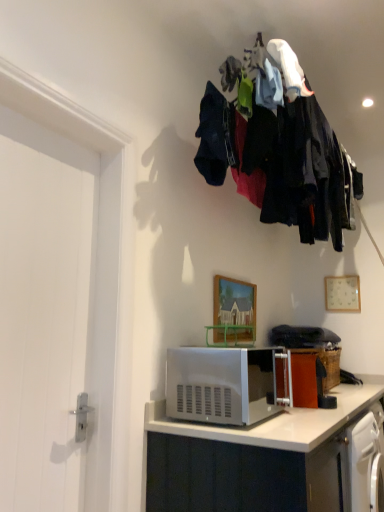
Describe the element at coordinates (342, 293) in the screenshot. This screenshot has width=384, height=512. I see `wooden picture frame at upper right, which appears as the 1th picture frame when viewed from the right` at that location.

What is the approximate width of wooden picture frame at upper right, the second picture frame positioned from the front?

wooden picture frame at upper right, the second picture frame positioned from the front, is 1.20 inches in width.

What do you see at coordinates (220, 385) in the screenshot? The height and width of the screenshot is (512, 384). I see `satin silver microwave at lower center` at bounding box center [220, 385].

What do you see at coordinates (44, 311) in the screenshot? Image resolution: width=384 pixels, height=512 pixels. I see `white smooth door at left` at bounding box center [44, 311].

Locate an element on the screen. Image resolution: width=384 pixels, height=512 pixels. wooden picture frame at upper right, which is counted as the 2th picture frame, starting from the left is located at coordinates (342, 293).

From the image's perspective, which one is positioned lower, silver metallic microwave at lower center or wooden painted picture frame at center, the second picture frame positioned from the back?

silver metallic microwave at lower center.

Is point (344, 395) more distant than point (253, 298)?

No, (344, 395) is closer to viewer.

From a real-world perspective, which picture frame is the 1st one above the silver metallic microwave at lower center? Please provide its 2D coordinates.

[(234, 310)]

Do you think silver metallic microwave at lower center is within wooden painted picture frame at center, placed as the first picture frame when sorted from front to back, or outside of it?

silver metallic microwave at lower center is outside wooden painted picture frame at center, placed as the first picture frame when sorted from front to back.

Considering the positions of points (303, 414) and (257, 374), is point (303, 414) farther from camera compared to point (257, 374)?

No, (303, 414) is in front of (257, 374).

Is silver metallic microwave at lower center far away from satin silver microwave at lower center?

No.

From the image's perspective, which is below, silver metallic microwave at lower center or satin silver microwave at lower center?

From the image's view, silver metallic microwave at lower center is below.

Would you say silver metallic microwave at lower center is to the left or to the right of satin silver microwave at lower center in the picture?

silver metallic microwave at lower center is positioned on satin silver microwave at lower center's right side.

From a real-world perspective, is satin silver microwave at lower center above or below dark fabric clothes at upper center?

From a real-world perspective, satin silver microwave at lower center is physically below dark fabric clothes at upper center.

Looking at this image, does satin silver microwave at lower center lie in front of dark fabric clothes at upper center?

No, the depth of satin silver microwave at lower center is greater than that of dark fabric clothes at upper center.

Considering the sizes of satin silver microwave at lower center and dark fabric clothes at upper center in the image, is satin silver microwave at lower center taller or shorter than dark fabric clothes at upper center?

In the image, satin silver microwave at lower center appears to be shorter than dark fabric clothes at upper center.

Would you say wooden picture frame at upper right, which appears as the 1th picture frame when viewed from the back, contains dark fabric clothes at upper center?

No, dark fabric clothes at upper center is located outside of wooden picture frame at upper right, which appears as the 1th picture frame when viewed from the back.

Based on their sizes in the image, would you say wooden picture frame at upper right, the second picture frame positioned from the front, is bigger or smaller than dark fabric clothes at upper center?

Considering their sizes, wooden picture frame at upper right, the second picture frame positioned from the front, takes up less space than dark fabric clothes at upper center.

Does point (327, 300) come in front of point (283, 90)?

No, (327, 300) is behind (283, 90).

Does wooden picture frame at upper right, the second picture frame positioned from the front, come in front of white smooth door at left?

No, wooden picture frame at upper right, the second picture frame positioned from the front, is behind white smooth door at left.

From a real-world perspective, between wooden picture frame at upper right, which is counted as the 2th picture frame, starting from the left, and white smooth door at left, who is vertically higher?

wooden picture frame at upper right, which is counted as the 2th picture frame, starting from the left, from a real-world perspective.

From the image's perspective, which object appears higher, wooden picture frame at upper right, which appears as the 1th picture frame when viewed from the back, or white smooth door at left?

white smooth door at left is shown above in the image.

You are a GUI agent. You are given a task and a screenshot of the screen. Output one action in this format:
    pyautogui.click(x=<x>, y=<y>)
    Task: Click on the 2nd picture frame behind when counting from the white smooth door at left
    The height and width of the screenshot is (512, 384).
    Given the screenshot: What is the action you would take?
    pyautogui.click(x=342, y=293)

I want to click on the 2nd picture frame positioned above the silver metallic microwave at lower center (from the image's perspective), so click(342, 293).

Which of these two, wooden picture frame at upper right, which is counted as the 2th picture frame, starting from the left, or silver metallic microwave at lower center, is wider?

Wider between the two is silver metallic microwave at lower center.

Does wooden picture frame at upper right, which appears as the 1th picture frame when viewed from the back, have a smaller size compared to silver metallic microwave at lower center?

Yes.

Is wooden picture frame at upper right, which appears as the 1th picture frame when viewed from the back, in front of or behind silver metallic microwave at lower center in the image?

Clearly, wooden picture frame at upper right, which appears as the 1th picture frame when viewed from the back, is behind silver metallic microwave at lower center.

Looking at this image, between wooden painted picture frame at center, the second picture frame positioned from the back, and wooden picture frame at upper right, which appears as the 1th picture frame when viewed from the back, which one has smaller width?

wooden picture frame at upper right, which appears as the 1th picture frame when viewed from the back, is thinner.

Does wooden painted picture frame at center, the second picture frame from the right, turn towards wooden picture frame at upper right, the second picture frame positioned from the front?

No, wooden painted picture frame at center, the second picture frame from the right, is not aimed at wooden picture frame at upper right, the second picture frame positioned from the front.

Is wooden painted picture frame at center, the second picture frame from the right, not within wooden picture frame at upper right, which appears as the 1th picture frame when viewed from the back?

Absolutely, wooden painted picture frame at center, the second picture frame from the right, is external to wooden picture frame at upper right, which appears as the 1th picture frame when viewed from the back.

Considering the relative positions of wooden painted picture frame at center, the second picture frame positioned from the back, and wooden picture frame at upper right, which appears as the 1th picture frame when viewed from the back, in the image provided, is wooden painted picture frame at center, the second picture frame positioned from the back, to the left of wooden picture frame at upper right, which appears as the 1th picture frame when viewed from the back, from the viewer's perspective?

Correct, you'll find wooden painted picture frame at center, the second picture frame positioned from the back, to the left of wooden picture frame at upper right, which appears as the 1th picture frame when viewed from the back.

The width and height of the screenshot is (384, 512). In order to click on picture frame on the left of silver metallic microwave at lower center in this screenshot , I will do `click(234, 310)`.

The width and height of the screenshot is (384, 512). Find the location of `cabinetry on the right of satin silver microwave at lower center`. cabinetry on the right of satin silver microwave at lower center is located at coordinates (271, 423).

Considering their positions, is silver metallic microwave at lower center positioned closer to satin silver microwave at lower center than wooden picture frame at upper right, the second picture frame positioned from the front?

Based on the image, silver metallic microwave at lower center appears to be nearer to satin silver microwave at lower center.

Looking at this image, from the image, which object appears to be nearer to silver metallic microwave at lower center, dark fabric clothes at upper center or wooden picture frame at upper right, which appears as the 1th picture frame when viewed from the back?

dark fabric clothes at upper center lies closer to silver metallic microwave at lower center than the other object.

Estimate the real-world distances between objects in this image. Which object is further from dark fabric clothes at upper center, white smooth door at left or wooden painted picture frame at center, the first picture frame positioned from the left?

The object further to dark fabric clothes at upper center is white smooth door at left.

Looking at the image, which one is located closer to satin silver microwave at lower center, silver metallic microwave at lower center or dark fabric clothes at upper center?

silver metallic microwave at lower center is positioned closer to the anchor satin silver microwave at lower center.

Looking at the image, which one is located closer to wooden painted picture frame at center, the first picture frame positioned from the left, satin silver microwave at lower center or dark fabric clothes at upper center?

satin silver microwave at lower center lies closer to wooden painted picture frame at center, the first picture frame positioned from the left, than the other object.

Looking at the image, which one is located closer to satin silver microwave at lower center, wooden painted picture frame at center, the second picture frame from the right, or wooden picture frame at upper right, which appears as the 1th picture frame when viewed from the back?

wooden painted picture frame at center, the second picture frame from the right, lies closer to satin silver microwave at lower center than the other object.

Consider the image. Looking at the image, which one is located further to satin silver microwave at lower center, white smooth door at left or wooden painted picture frame at center, the second picture frame from the right?

The object further to satin silver microwave at lower center is white smooth door at left.

Based on their spatial positions, is dark fabric clothes at upper center or wooden picture frame at upper right, which appears as the 1th picture frame when viewed from the back, further from wooden painted picture frame at center, the second picture frame from the right?

Among the two, wooden picture frame at upper right, which appears as the 1th picture frame when viewed from the back, is located further to wooden painted picture frame at center, the second picture frame from the right.

Locate an element on the screen. picture frame between satin silver microwave at lower center and wooden picture frame at upper right, which appears as the 1th picture frame when viewed from the back, in the front-back direction is located at coordinates (234, 310).

What are the coordinates of `microwave oven located between white smooth door at left and wooden picture frame at upper right, which is counted as the 2th picture frame, starting from the left, in the depth direction` in the screenshot? It's located at (220, 385).

At what (x,y) coordinates should I click in order to perform the action: click on laundry positioned between white smooth door at left and wooden painted picture frame at center, the first picture frame positioned from the left, from near to far. Please return your answer as a coordinate pair (x, y). The width and height of the screenshot is (384, 512). Looking at the image, I should click on (278, 145).

Locate an element on the screen. The height and width of the screenshot is (512, 384). microwave oven between silver metallic microwave at lower center and wooden picture frame at upper right, which appears as the 1th picture frame when viewed from the back, along the z-axis is located at coordinates (220, 385).